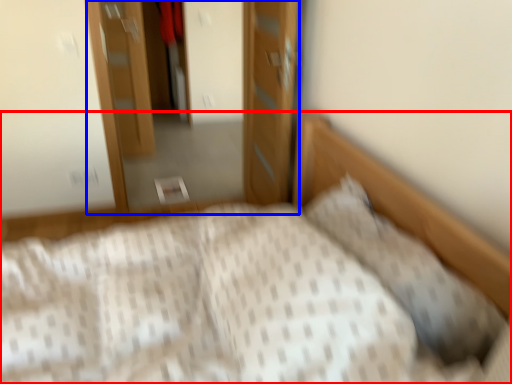
Question: Which of the following is the farthest to the observer, bed (highlighted by a red box) or dresser (highlighted by a blue box)?

Choices:
 (A) bed
 (B) dresser

Answer: (B)